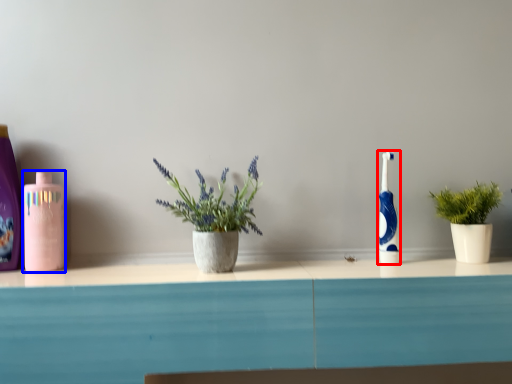
Question: Among these objects, which one is farthest to the camera, toothbrush (highlighted by a red box) or mouthwash (highlighted by a blue box)?

Choices:
 (A) toothbrush
 (B) mouthwash

Answer: (A)